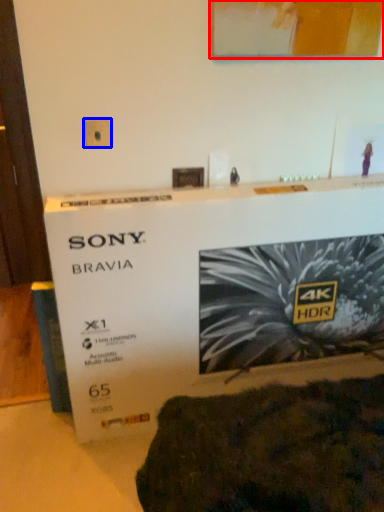
Question: Which object appears farthest to the camera in this image, picture frame (highlighted by a red box) or electric outlet (highlighted by a blue box)?

Choices:
 (A) picture frame
 (B) electric outlet

Answer: (B)